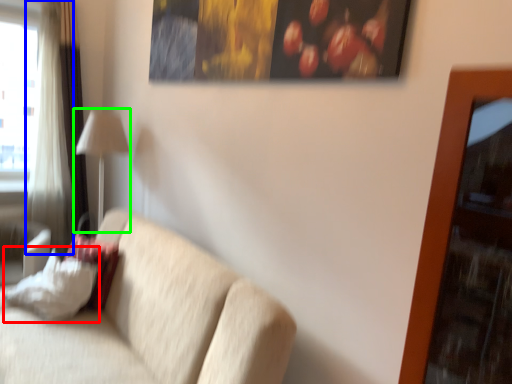
Question: Which object is the farthest from pillow (highlighted by a red box)? Choose among these: curtain (highlighted by a blue box) or table lamp (highlighted by a green box).

Choices:
 (A) curtain
 (B) table lamp

Answer: (A)